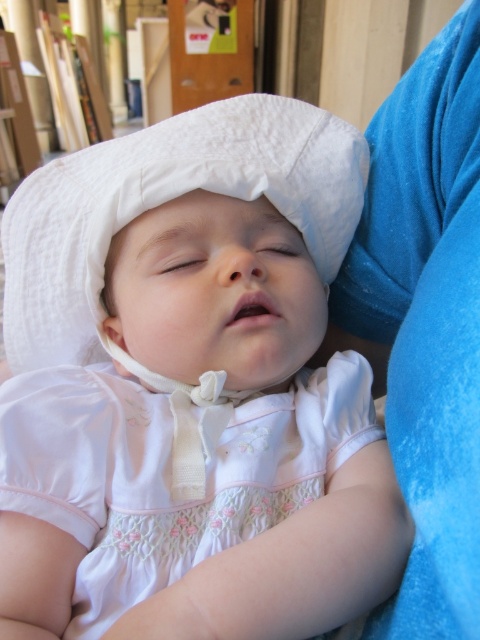
Is the position of white cotton bonnet at upper center more distant than that of white satin dress at center?

No, white cotton bonnet at upper center is closer to the viewer.

From the picture: Is white cotton bonnet at upper center positioned in front of white satin dress at center?

Yes, white cotton bonnet at upper center is in front of white satin dress at center.

Which is in front, point (96, 211) or point (243, 458)?

Point (243, 458) is more forward.

Identify the location of white cotton bonnet at upper center. Image resolution: width=480 pixels, height=640 pixels. (191, 388).

Can you confirm if white satin dress at center is thinner than white cotton bonnet at center?

Indeed, white satin dress at center has a lesser width compared to white cotton bonnet at center.

Does white satin dress at center have a greater height compared to white cotton bonnet at center?

Incorrect, white satin dress at center's height is not larger of white cotton bonnet at center's.

Locate an element on the screen. This screenshot has height=640, width=480. white satin dress at center is located at coordinates (167, 472).

Identify the location of white satin dress at center. (167, 472).

Is white cotton bonnet at upper center taller than white cotton bonnet at center?

Correct, white cotton bonnet at upper center is much taller as white cotton bonnet at center.

Who is more distant from viewer, (344,163) or (87,163)?

The point (87,163) is behind.

Is point (254, 310) farther from camera compared to point (333, 253)?

No.

This screenshot has height=640, width=480. I want to click on white cotton bonnet at upper center, so click(191, 388).